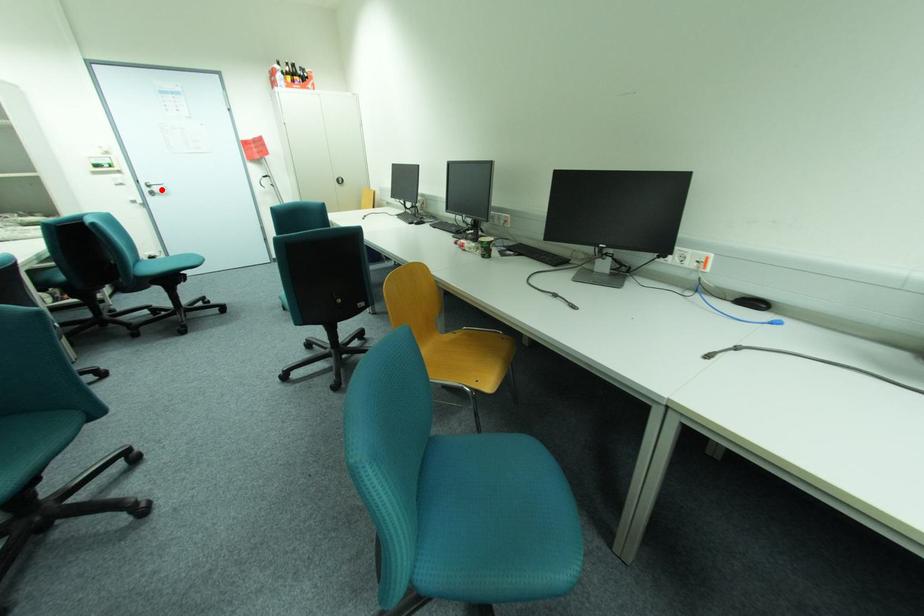
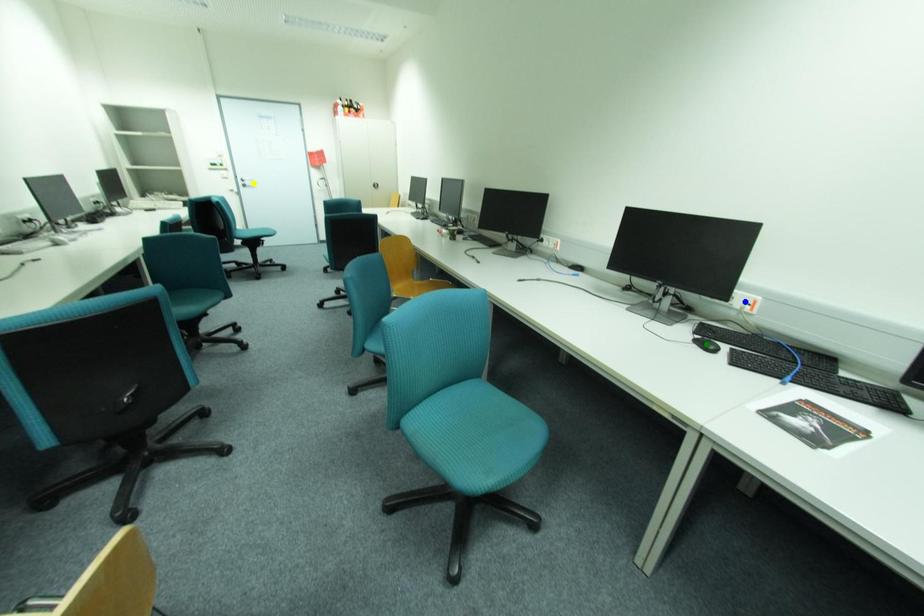
Question: I am providing you with two images of the same scene from different viewpoints. A red point is marked on the first image. You are given multiple points on the second image. Which point in image 2 is actually the same real-world point as the red point in image 1?

Choices:
 (A) green point
 (B) yellow point
 (C) blue point

Answer: (B)